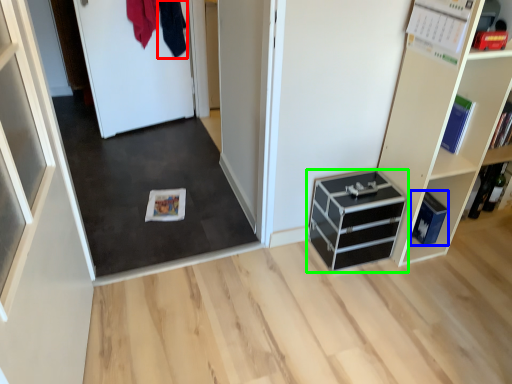
Question: Considering the real-world distances, which object is closest to clothing (highlighted by a red box)? cabinetry (highlighted by a blue box) or chest of drawers (highlighted by a green box).

Choices:
 (A) cabinetry
 (B) chest of drawers

Answer: (B)